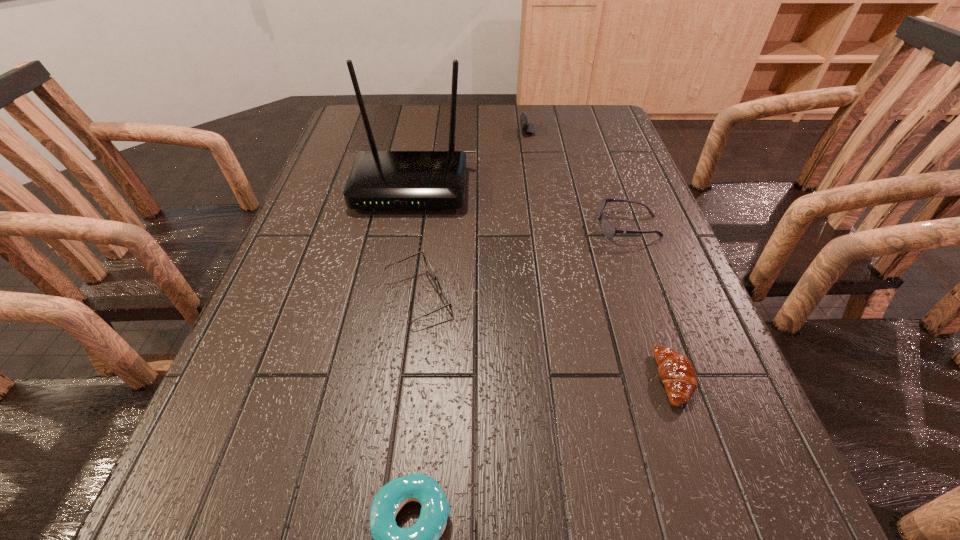
Where is `vacant space at the far edge of the desktop`? vacant space at the far edge of the desktop is located at coordinates pos(472,130).

Image resolution: width=960 pixels, height=540 pixels. What are the coordinates of `free space at the near edge` in the screenshot? It's located at (520, 538).

In the image, there is a desktop. Find the location of `free space at the right edge`. free space at the right edge is located at coordinates (593, 182).

In the image, there is a desktop. Identify the location of free region at the far left corner. The width and height of the screenshot is (960, 540). (347, 120).

Identify the location of vacant space at the far right corner of the desktop. The height and width of the screenshot is (540, 960). (589, 106).

You are a GUI agent. You are given a task and a screenshot of the screen. Output one action in this format:
    pyautogui.click(x=<x>, y=<y>)
    Task: Click on the empty space that is in between the third nearest object and the router
    This screenshot has width=960, height=540.
    Given the screenshot: What is the action you would take?
    pyautogui.click(x=415, y=242)

Identify the location of unoccupied area between the tallest object and the crescent roll. This screenshot has width=960, height=540. 542,283.

Locate an element on the screen. free space between the sunglasses and the router is located at coordinates (519, 207).

The image size is (960, 540). What are the coordinates of `vacant space in between the crescent roll and the fourth farthest object` in the screenshot? It's located at (546, 338).

Identify the location of free space between the sunglasses and the crescent roll. (651, 302).